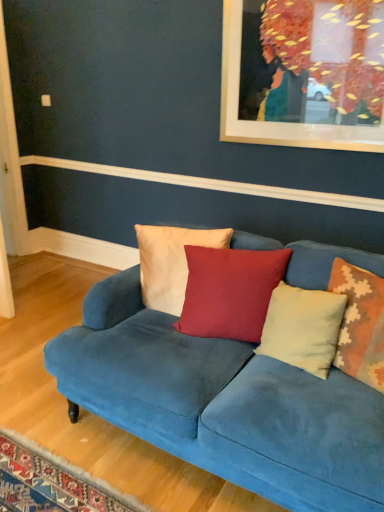
Find the location of `light beige velvet pillow at center, which ranks as the third pillow in left-to-right order`. light beige velvet pillow at center, which ranks as the third pillow in left-to-right order is located at coordinates (303, 328).

In order to click on white cotton pillow at center, placed as the 1th pillow when sorted from left to right in this screenshot , I will do `click(171, 262)`.

What is the approximate width of velvet blue couch at center?

3.56 feet.

This screenshot has height=512, width=384. Describe the element at coordinates (223, 404) in the screenshot. I see `velvet blue couch at center` at that location.

Where is `light beige velvet pillow at center, which ranks as the third pillow in left-to-right order`? The width and height of the screenshot is (384, 512). light beige velvet pillow at center, which ranks as the third pillow in left-to-right order is located at coordinates [x=303, y=328].

From a real-world perspective, is matte red cushion at center, the 2th pillow positioned from the left, under light beige velvet pillow at center, positioned as the second pillow in right-to-left order?

No, from a real-world perspective, matte red cushion at center, the 2th pillow positioned from the left, is not below light beige velvet pillow at center, positioned as the second pillow in right-to-left order.

Is matte red cushion at center, the 2th pillow positioned from the left, at the left side of light beige velvet pillow at center, positioned as the second pillow in right-to-left order?

Indeed, matte red cushion at center, the 2th pillow positioned from the left, is positioned on the left side of light beige velvet pillow at center, positioned as the second pillow in right-to-left order.

Which object is thinner, matte red cushion at center, the 2th pillow positioned from the left, or light beige velvet pillow at center, which ranks as the third pillow in left-to-right order?

light beige velvet pillow at center, which ranks as the third pillow in left-to-right order, is thinner.

From a real-world perspective, which is physically below, velvet blue couch at center or white cotton pillow at center, placed as the 1th pillow when sorted from left to right?

In real-world perspective, velvet blue couch at center is lower.

How different are the orientations of velvet blue couch at center and white cotton pillow at center, the fourth pillow viewed from the right, in degrees?

velvet blue couch at center and white cotton pillow at center, the fourth pillow viewed from the right, are facing 13.2 degrees away from each other.

Does velvet blue couch at center touch white cotton pillow at center, placed as the 1th pillow when sorted from left to right?

No, velvet blue couch at center is not with white cotton pillow at center, placed as the 1th pillow when sorted from left to right.

Considering the sizes of light beige velvet pillow at center, which ranks as the third pillow in left-to-right order, and beige textured pillow at right, which is the fourth pillow in left-to-right order, in the image, is light beige velvet pillow at center, which ranks as the third pillow in left-to-right order, wider or thinner than beige textured pillow at right, which is the fourth pillow in left-to-right order,?

In the image, light beige velvet pillow at center, which ranks as the third pillow in left-to-right order, appears to be more narrow than beige textured pillow at right, which is the fourth pillow in left-to-right order.

Considering the positions of point (310, 364) and point (373, 348), is point (310, 364) closer or farther from the camera than point (373, 348)?

Point (310, 364) appears to be farther away from the viewer than point (373, 348).

Based on the photo, is light beige velvet pillow at center, positioned as the second pillow in right-to-left order, not within beige textured pillow at right, which is counted as the 1th pillow, starting from the right?

light beige velvet pillow at center, positioned as the second pillow in right-to-left order, lies outside beige textured pillow at right, which is counted as the 1th pillow, starting from the right,'s area.

Between light beige velvet pillow at center, which ranks as the third pillow in left-to-right order, and beige textured pillow at right, which is counted as the 1th pillow, starting from the right, which one appears on the left side from the viewer's perspective?

From the viewer's perspective, light beige velvet pillow at center, which ranks as the third pillow in left-to-right order, appears more on the left side.

What's the angular difference between white cotton pillow at center, placed as the 1th pillow when sorted from left to right, and light beige velvet pillow at center, positioned as the second pillow in right-to-left order,'s facing directions?

There is a 25.2-degree angle between the facing directions of white cotton pillow at center, placed as the 1th pillow when sorted from left to right, and light beige velvet pillow at center, positioned as the second pillow in right-to-left order.

Considering the relative positions of white cotton pillow at center, placed as the 1th pillow when sorted from left to right, and light beige velvet pillow at center, positioned as the second pillow in right-to-left order, in the image provided, is white cotton pillow at center, placed as the 1th pillow when sorted from left to right, to the right of light beige velvet pillow at center, positioned as the second pillow in right-to-left order, from the viewer's perspective?

No.

Can you confirm if white cotton pillow at center, the fourth pillow viewed from the right, is smaller than light beige velvet pillow at center, positioned as the second pillow in right-to-left order?

Actually, white cotton pillow at center, the fourth pillow viewed from the right, might be larger than light beige velvet pillow at center, positioned as the second pillow in right-to-left order.

Is white cotton pillow at center, placed as the 1th pillow when sorted from left to right, in front of light beige velvet pillow at center, which ranks as the third pillow in left-to-right order?

No, white cotton pillow at center, placed as the 1th pillow when sorted from left to right, is behind light beige velvet pillow at center, which ranks as the third pillow in left-to-right order.

Would you say white cotton pillow at center, the fourth pillow viewed from the right, contains beige textured pillow at right, which is the fourth pillow in left-to-right order?

No, beige textured pillow at right, which is the fourth pillow in left-to-right order, is located outside of white cotton pillow at center, the fourth pillow viewed from the right.

Which object is positioned more to the left, white cotton pillow at center, placed as the 1th pillow when sorted from left to right, or beige textured pillow at right, which is counted as the 1th pillow, starting from the right?

white cotton pillow at center, placed as the 1th pillow when sorted from left to right.

Does white cotton pillow at center, placed as the 1th pillow when sorted from left to right, turn towards beige textured pillow at right, which is counted as the 1th pillow, starting from the right?

No, white cotton pillow at center, placed as the 1th pillow when sorted from left to right, does not turn towards beige textured pillow at right, which is counted as the 1th pillow, starting from the right.

How distant is white cotton pillow at center, placed as the 1th pillow when sorted from left to right, from beige textured pillow at right, which is counted as the 1th pillow, starting from the right?

white cotton pillow at center, placed as the 1th pillow when sorted from left to right, is 70.81 centimeters from beige textured pillow at right, which is counted as the 1th pillow, starting from the right.

Is matte red cushion at center, the 2th pillow positioned from the left, smaller than white cotton pillow at center, the fourth pillow viewed from the right?

Incorrect, matte red cushion at center, the 2th pillow positioned from the left, is not smaller in size than white cotton pillow at center, the fourth pillow viewed from the right.

Is matte red cushion at center, the 3th pillow from the right, at the right side of white cotton pillow at center, placed as the 1th pillow when sorted from left to right?

Yes.

Is matte red cushion at center, the 2th pillow positioned from the left, beside white cotton pillow at center, the fourth pillow viewed from the right?

No, matte red cushion at center, the 2th pillow positioned from the left, is not touching white cotton pillow at center, the fourth pillow viewed from the right.

From the image's perspective, which one is positioned higher, matte red cushion at center, the 2th pillow positioned from the left, or white cotton pillow at center, the fourth pillow viewed from the right?

white cotton pillow at center, the fourth pillow viewed from the right.

Is light beige velvet pillow at center, which ranks as the third pillow in left-to-right order, looking in the opposite direction of matte red cushion at center, the 2th pillow positioned from the left?

That's not correct — light beige velvet pillow at center, which ranks as the third pillow in left-to-right order, is not looking away from matte red cushion at center, the 2th pillow positioned from the left.

From the image's perspective, is light beige velvet pillow at center, which ranks as the third pillow in left-to-right order, positioned above or below matte red cushion at center, the 2th pillow positioned from the left?

From the image's perspective, light beige velvet pillow at center, which ranks as the third pillow in left-to-right order, appears below matte red cushion at center, the 2th pillow positioned from the left.

Which object is closer to the camera, light beige velvet pillow at center, positioned as the second pillow in right-to-left order, or matte red cushion at center, the 3th pillow from the right?

light beige velvet pillow at center, positioned as the second pillow in right-to-left order, is more forward.

You are a GUI agent. You are given a task and a screenshot of the screen. Output one action in this format:
    pyautogui.click(x=<x>, y=<y>)
    Task: Click on the 1st pillow to the left of the light beige velvet pillow at center, positioned as the second pillow in right-to-left order, starting your count from the anchor
    This screenshot has width=384, height=512.
    Given the screenshot: What is the action you would take?
    pyautogui.click(x=230, y=291)

The width and height of the screenshot is (384, 512). I want to click on studio couch directly beneath the white cotton pillow at center, the fourth pillow viewed from the right (from a real-world perspective), so click(223, 404).

Which object lies further to the anchor point matte red cushion at center, the 2th pillow positioned from the left, light beige velvet pillow at center, positioned as the second pillow in right-to-left order, or beige textured pillow at right, which is counted as the 1th pillow, starting from the right?

beige textured pillow at right, which is counted as the 1th pillow, starting from the right, lies further to matte red cushion at center, the 2th pillow positioned from the left, than the other object.

Based on their spatial positions, is matte red cushion at center, the 2th pillow positioned from the left, or white cotton pillow at center, placed as the 1th pillow when sorted from left to right, further from beige textured pillow at right, which is counted as the 1th pillow, starting from the right?

white cotton pillow at center, placed as the 1th pillow when sorted from left to right, is positioned further to the anchor beige textured pillow at right, which is counted as the 1th pillow, starting from the right.

When comparing their distances from beige textured pillow at right, which is the fourth pillow in left-to-right order, does light beige velvet pillow at center, which ranks as the third pillow in left-to-right order, or matte red cushion at center, the 3th pillow from the right, seem further?

matte red cushion at center, the 3th pillow from the right, is further to beige textured pillow at right, which is the fourth pillow in left-to-right order.

Looking at the image, which one is located closer to white cotton pillow at center, placed as the 1th pillow when sorted from left to right, light beige velvet pillow at center, which ranks as the third pillow in left-to-right order, or matte red cushion at center, the 3th pillow from the right?

matte red cushion at center, the 3th pillow from the right, is closer to white cotton pillow at center, placed as the 1th pillow when sorted from left to right.

Which object lies nearer to the anchor point white cotton pillow at center, placed as the 1th pillow when sorted from left to right, beige textured pillow at right, which is counted as the 1th pillow, starting from the right, or matte red cushion at center, the 3th pillow from the right?

Based on the image, matte red cushion at center, the 3th pillow from the right, appears to be nearer to white cotton pillow at center, placed as the 1th pillow when sorted from left to right.

Based on their spatial positions, is light beige velvet pillow at center, positioned as the second pillow in right-to-left order, or velvet blue couch at center further from matte red cushion at center, the 2th pillow positioned from the left?

The object further to matte red cushion at center, the 2th pillow positioned from the left, is velvet blue couch at center.

When comparing their distances from beige textured pillow at right, which is the fourth pillow in left-to-right order, does light beige velvet pillow at center, which ranks as the third pillow in left-to-right order, or velvet blue couch at center seem further?

The object further to beige textured pillow at right, which is the fourth pillow in left-to-right order, is velvet blue couch at center.

Considering their positions, is matte red cushion at center, the 3th pillow from the right, positioned closer to white cotton pillow at center, placed as the 1th pillow when sorted from left to right, than beige textured pillow at right, which is counted as the 1th pillow, starting from the right?

matte red cushion at center, the 3th pillow from the right, lies closer to white cotton pillow at center, placed as the 1th pillow when sorted from left to right, than the other object.

Identify the location of pillow situated between white cotton pillow at center, placed as the 1th pillow when sorted from left to right, and light beige velvet pillow at center, positioned as the second pillow in right-to-left order, from left to right. This screenshot has height=512, width=384. (230, 291).

Where is `pillow between velvet blue couch at center and light beige velvet pillow at center, which ranks as the third pillow in left-to-right order, along the z-axis`? Image resolution: width=384 pixels, height=512 pixels. pillow between velvet blue couch at center and light beige velvet pillow at center, which ranks as the third pillow in left-to-right order, along the z-axis is located at coordinates (360, 323).

The width and height of the screenshot is (384, 512). I want to click on pillow located between matte red cushion at center, the 3th pillow from the right, and beige textured pillow at right, which is the fourth pillow in left-to-right order, in the left-right direction, so click(x=303, y=328).